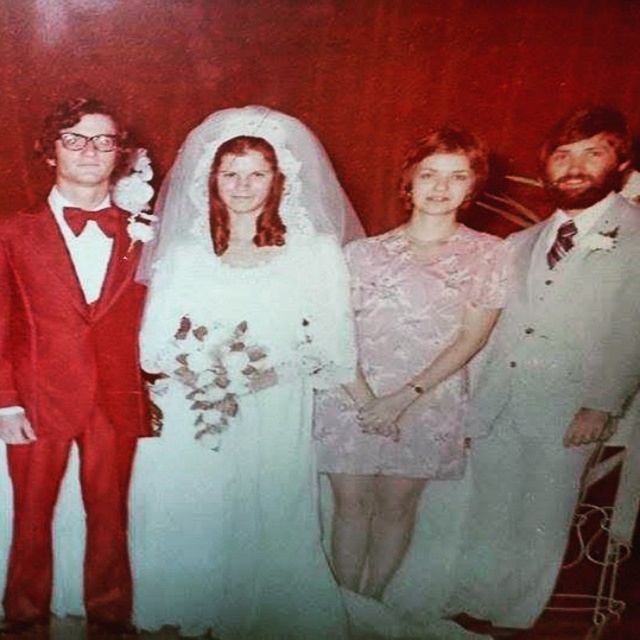
You are standing in front of the wedding photo and notice two points marked on it. The first point is at coordinates point (528, 500) and the second is at point (68, 268). Which of these points is closer to you?

Point (528, 500) is closer to you because it is further to the viewer than point (68, 268).